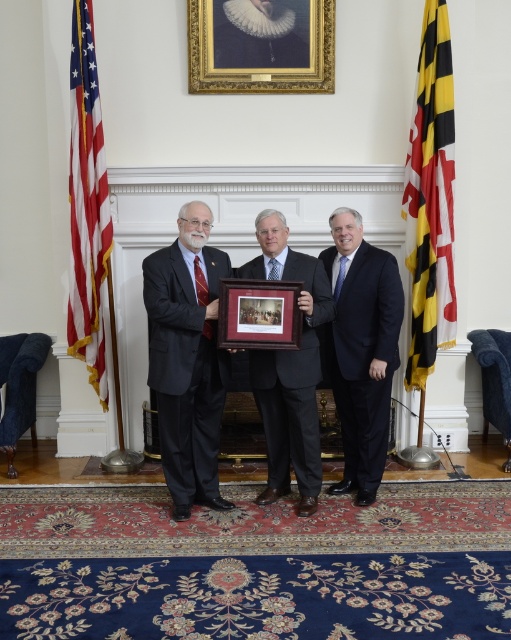
Based on the provided scene description, what is the spatial coordinate of the white lace collar at upper center?

The white lace collar at upper center is located at coordinate point 0.056 on the x axis and 0.503 on the y axis.

Based on the provided scene, which object corresponds to the coordinates point [361,349]?

The dark blue suit at center corresponds to the coordinates point [361,349] as specified in the objects description.